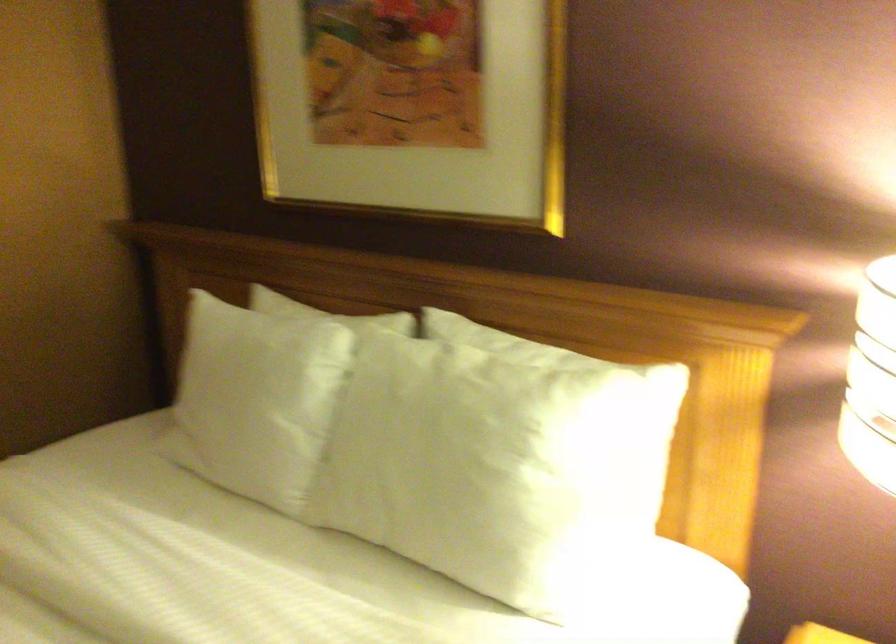
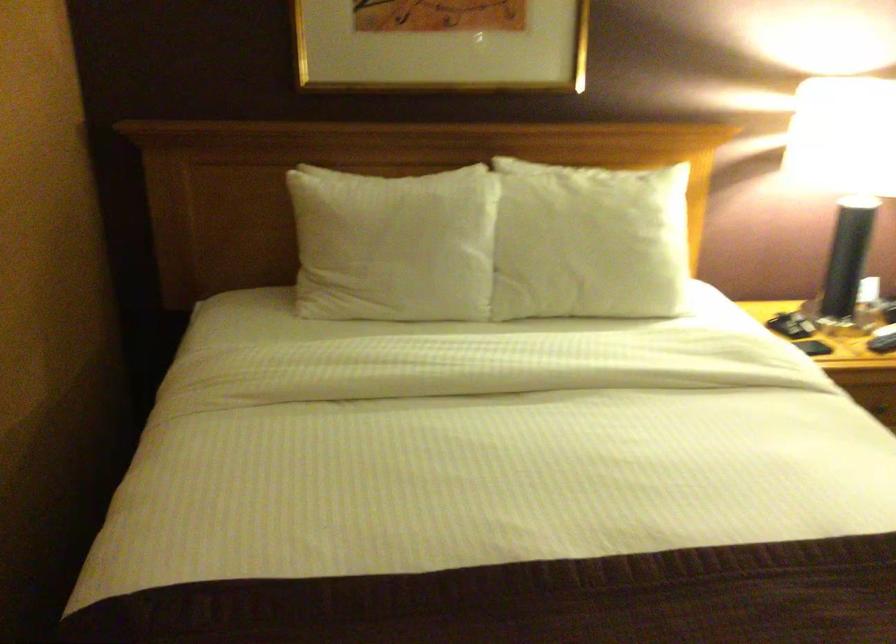
Find the pixel in the second image that matches point (224, 393) in the first image.

(393, 245)